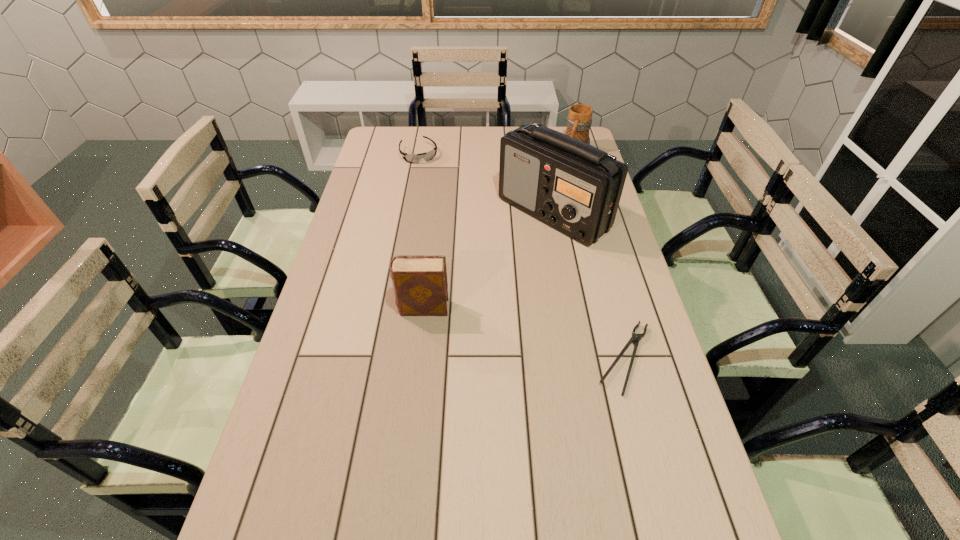
Where is `empty space between the second shortest object and the mug`? The height and width of the screenshot is (540, 960). empty space between the second shortest object and the mug is located at coordinates (497, 152).

Where is `free space that is in between the sunglasses and the nearest object`? free space that is in between the sunglasses and the nearest object is located at coordinates (522, 256).

This screenshot has width=960, height=540. Find the location of `empty space between the third nearest object and the second shortest object`. empty space between the third nearest object and the second shortest object is located at coordinates (486, 183).

You are a GUI agent. You are given a task and a screenshot of the screen. Output one action in this format:
    pyautogui.click(x=<x>, y=<y>)
    Task: Click on the object that is the fourth closest to the mug
    The image size is (960, 540).
    Given the screenshot: What is the action you would take?
    pyautogui.click(x=420, y=285)

The image size is (960, 540). What are the coordinates of `the second closest object to the third nearest object` in the screenshot? It's located at (420, 285).

Find the location of a particular element. vacant space that satisfies the following two spatial constraints: 1. on the back side of the mug; 2. on the left side of the nearest object is located at coordinates (569, 151).

Locate an element on the screen. The width and height of the screenshot is (960, 540). vacant space that satisfies the following two spatial constraints: 1. on the front side of the radio receiver; 2. on the left side of the tongs is located at coordinates tap(581, 358).